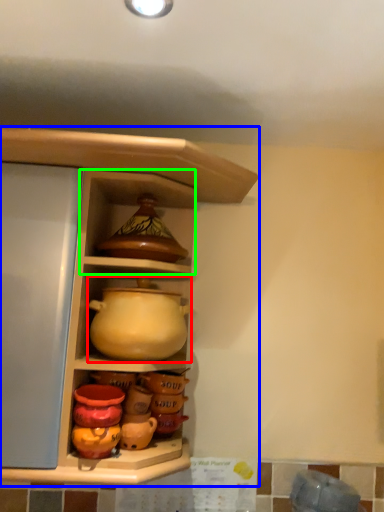
Question: Which object is positioned closest to jug (highlighted by a red box)? Select from shelf (highlighted by a blue box) and cabinet (highlighted by a green box).

Choices:
 (A) shelf
 (B) cabinet

Answer: (A)